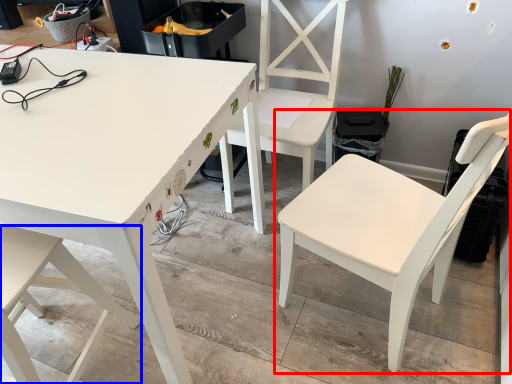
Question: Which object appears farthest to the camera in this image, chair (highlighted by a red box) or chair (highlighted by a blue box)?

Choices:
 (A) chair
 (B) chair

Answer: (B)